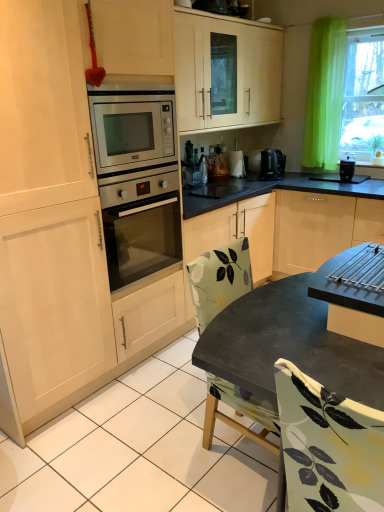
Question: From their relative heights in the image, would you say black plastic coffee maker at right is taller or shorter than green sheer curtain at upper right?

Choices:
 (A) short
 (B) tall

Answer: (A)

Question: Relative to green sheer curtain at upper right, is black plastic coffee maker at right in front or behind?

Choices:
 (A) front
 (B) behind

Answer: (B)

Question: Estimate the real-world distances between objects in this image. Which object is closer to the metallic silver coffee maker at upper right?

Choices:
 (A) satin silver oven at center
 (B) black plastic coffee maker at right
 (C) green sheer curtain at upper right
 (D) matte black table at center

Answer: (B)

Question: Based on their relative distances, which object is farther from the matte black table at center?

Choices:
 (A) green sheer curtain at upper right
 (B) metallic silver coffee maker at upper right
 (C) black plastic coffee maker at right
 (D) satin silver oven at center

Answer: (B)